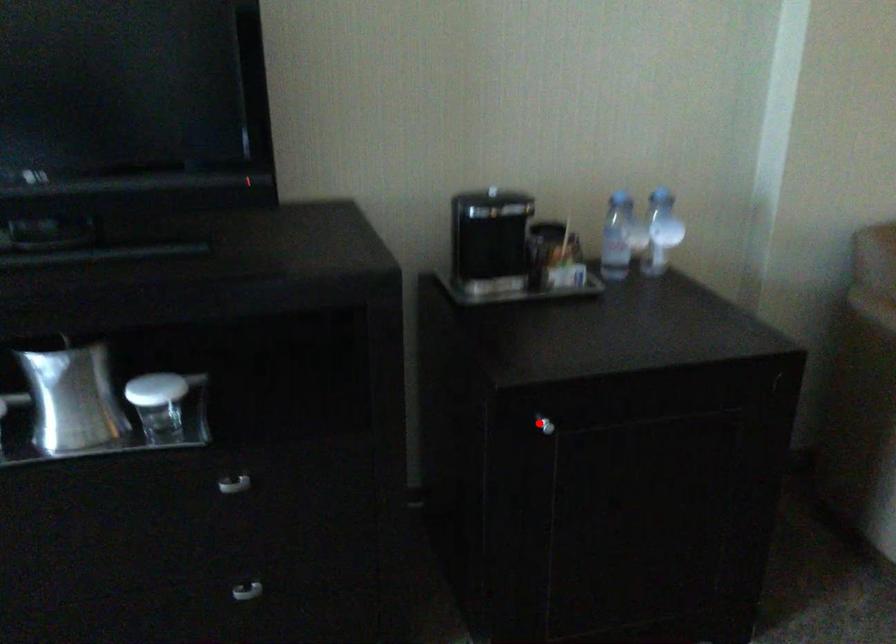
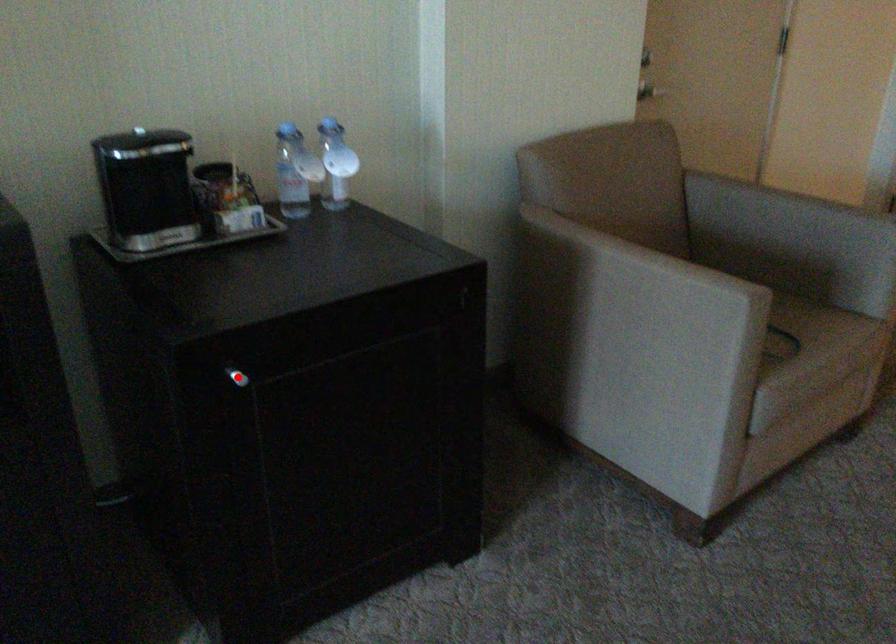
I am providing you with two images of the same scene from different viewpoints. A red point is marked on the first image and another point is marked on the second image. Is the red point in image1 aligned with the point shown in image2?

Yes